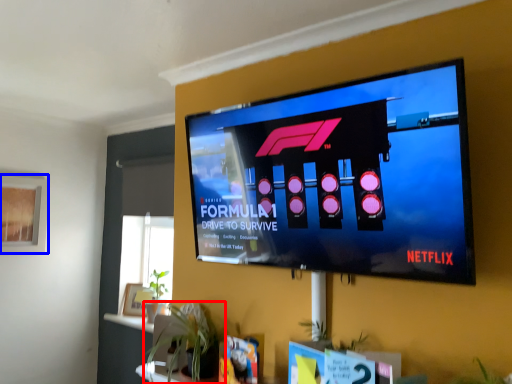
Question: Which point is closer to the camera, houseplant (highlighted by a red box) or window screen (highlighted by a blue box)?

Choices:
 (A) houseplant
 (B) window screen

Answer: (A)